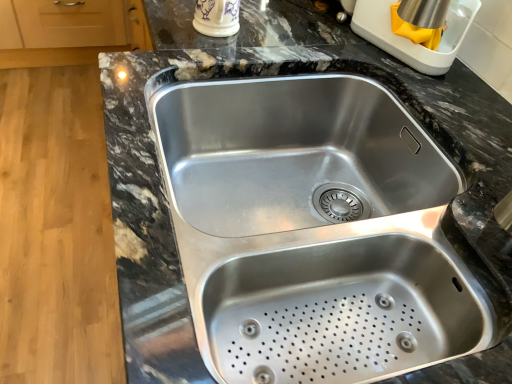
Question: Is porcelain cup at upper center, the 2th appliance viewed from the right, bigger or smaller than stainless steel kettle at upper right, the second appliance when ordered from left to right?

Choices:
 (A) big
 (B) small

Answer: (B)

Question: Relative to stainless steel kettle at upper right, the second appliance when ordered from left to right, is porcelain cup at upper center, the first appliance positioned from the left, in front or behind?

Choices:
 (A) behind
 (B) front

Answer: (A)

Question: Which of these objects is positioned farthest from the stainless steel kettle at upper right, which ranks as the first appliance in right-to-left order?

Choices:
 (A) porcelain cup at upper center, the 2th appliance viewed from the right
 (B) stainless steel sink at center

Answer: (B)

Question: Which of these objects is positioned closest to the stainless steel kettle at upper right, which ranks as the first appliance in right-to-left order?

Choices:
 (A) porcelain cup at upper center, the first appliance positioned from the left
 (B) stainless steel sink at center

Answer: (A)